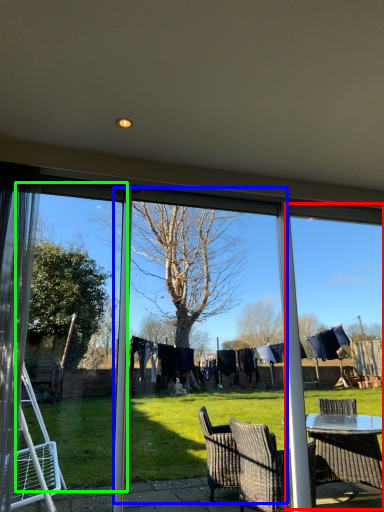
Question: Considering the real-world distances, which object is closest to window frame (highlighted by a red box)? screen door (highlighted by a blue box) or screen door (highlighted by a green box).

Choices:
 (A) screen door
 (B) screen door

Answer: (B)